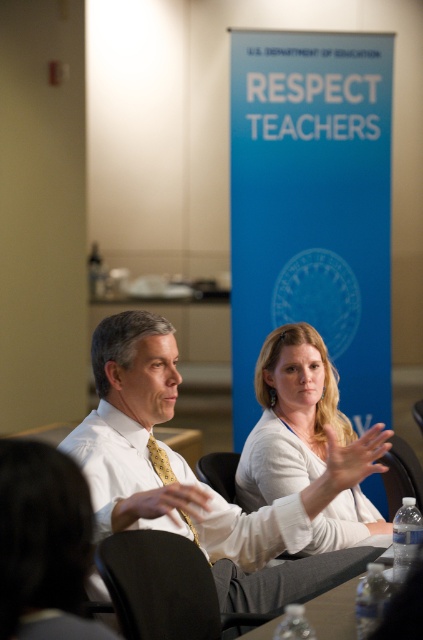
You are organizing a school event and need to ensure that all items on the table are visible. The white matte shirt at center and the clear plastic water bottles at lower center are on the table. Which item takes up more space on the table?

The white matte shirt at center has a larger size compared to clear plastic water bottles at lower center, so it takes up more space on the table.

You are a photographer taking a picture of the two people seated at the table. You notice the white shirt at center and the white matte shirt at center. Which one is closer to the camera?

The white shirt at center is positioned under the white matte shirt at center, so the white matte shirt at center is closer to the camera.

You are a photographer taking a picture of the scene described. You need to ensure that the white matte shirt at center and the clear plastic water bottles at lower center are both in focus. Based on their positions, which object should you focus on first to ensure both are sharp?

The white matte shirt at center is positioned on the right side of clear plastic water bottles at lower center. To ensure both are in focus, you should focus on the clear plastic water bottles at lower center since it is closer to the camera, allowing the depth of field to cover the shirt which is further away.